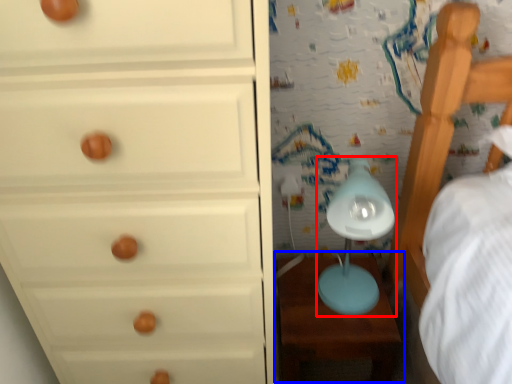
Question: Which of the following is the farthest to the observer, table lamp (highlighted by a red box) or table (highlighted by a blue box)?

Choices:
 (A) table lamp
 (B) table

Answer: (B)